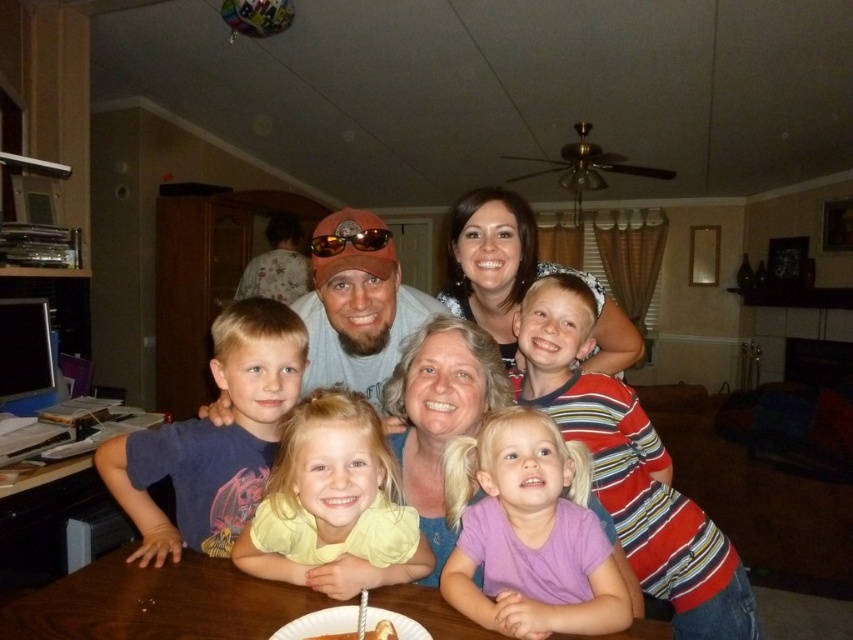
Question: Among these objects, which one is nearest to the camera?

Choices:
 (A) yellow satin shirt at center
 (B) brown wooden table at lower left
 (C) orange reflective lens cap at center
 (D) smooth chocolate cake at center

Answer: (D)

Question: Considering the real-world distances, which object is closest to the brown wooden table at lower center?

Choices:
 (A) orange reflective lens cap at center
 (B) purple cotton shirt at lower center
 (C) smooth chocolate cake at center
 (D) yellow satin shirt at center

Answer: (D)

Question: Does brown wooden table at lower left have a lesser width compared to orange reflective lens cap at center?

Choices:
 (A) yes
 (B) no

Answer: (B)

Question: Among these points, which one is farthest from the camera?

Choices:
 (A) (512, 284)
 (B) (381, 630)
 (C) (59, 580)
 (D) (88, 538)

Answer: (D)

Question: Is the position of brown wooden table at lower left less distant than that of orange reflective lens cap at center?

Choices:
 (A) yes
 (B) no

Answer: (B)

Question: Does dark blue t-shirt at left have a lesser width compared to brown wooden table at lower left?

Choices:
 (A) yes
 (B) no

Answer: (A)